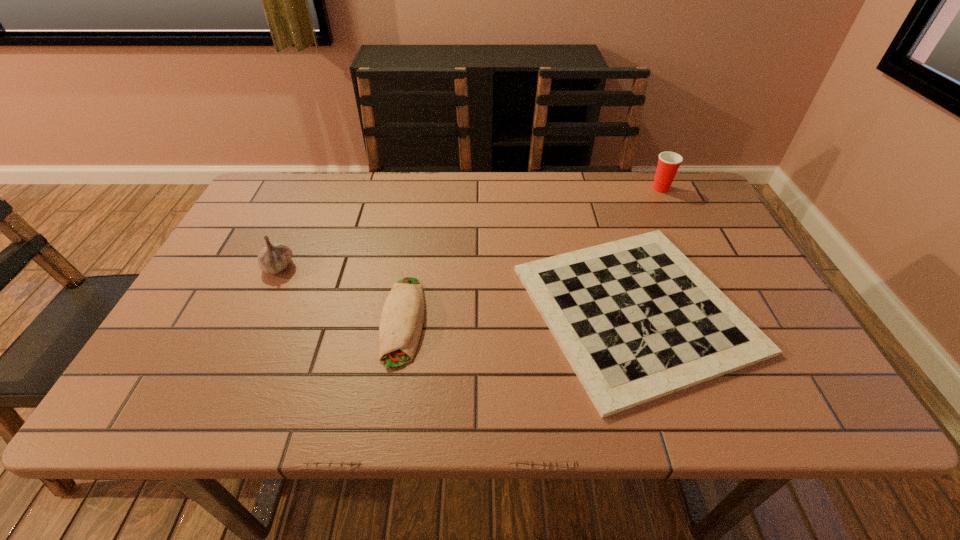
Find the location of a particular element. The width and height of the screenshot is (960, 540). Dixie cup is located at coordinates (668, 163).

At what (x,y) coordinates should I click in order to perform the action: click on garlic. Please return your answer as a coordinate pair (x, y). The width and height of the screenshot is (960, 540). Looking at the image, I should click on (273, 258).

The image size is (960, 540). I want to click on the second object from left to right, so click(x=401, y=321).

Identify the location of the third tallest object. Image resolution: width=960 pixels, height=540 pixels. tap(401, 321).

Where is `the shortest object`? The image size is (960, 540). the shortest object is located at coordinates (636, 319).

I want to click on vacant region located 0.210m on the front of the farthest object, so click(x=687, y=240).

Find the location of a particular element. This screenshot has height=540, width=960. free spot located 0.090m on the front of the leftmost object is located at coordinates (259, 307).

This screenshot has width=960, height=540. Identify the location of vacant region located at the bitten end of the third tallest object. (390, 407).

Identify the location of free space located on the back of the shortest object. The width and height of the screenshot is (960, 540). (592, 179).

Where is `object at the far edge`? object at the far edge is located at coordinates (668, 163).